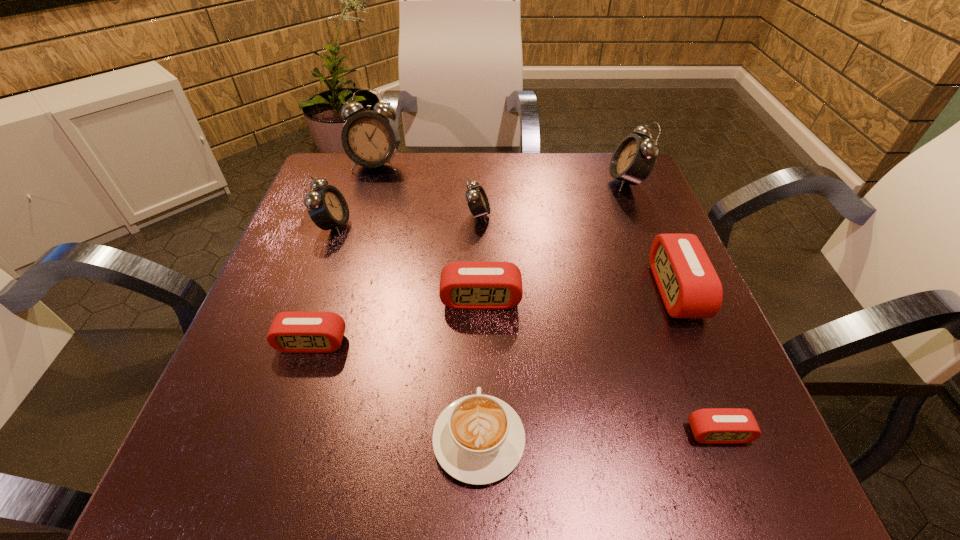
This screenshot has width=960, height=540. I want to click on free space that satisfies the following two spatial constraints: 1. on the face of the rightmost white alarm clock; 2. on the front-facing side of the third smallest pink alarm clock, so click(x=675, y=299).

The width and height of the screenshot is (960, 540). Identify the location of free region that satisfies the following two spatial constraints: 1. on the front-facing side of the biggest pink alarm clock; 2. on the front-facing side of the sixth tallest object. (679, 299).

Identify the location of vacant region that satisfies the following two spatial constraints: 1. on the face of the third white alarm clock from left to right; 2. on the front-facing side of the second nearest alarm clock. (x=478, y=343).

Identify the location of blank area in the image that satisfies the following two spatial constraints: 1. on the front-facing side of the biggest pink alarm clock; 2. on the front-facing side of the fourth shortest object. (679, 299).

You are a GUI agent. You are given a task and a screenshot of the screen. Output one action in this format:
    pyautogui.click(x=<x>, y=<y>)
    Task: Click on the blank space that satisfies the following two spatial constraints: 1. on the side of the cappuccino with the handle; 2. on the face of the second white alarm clock from right to left
    This screenshot has width=960, height=540.
    Given the screenshot: What is the action you would take?
    pyautogui.click(x=479, y=215)